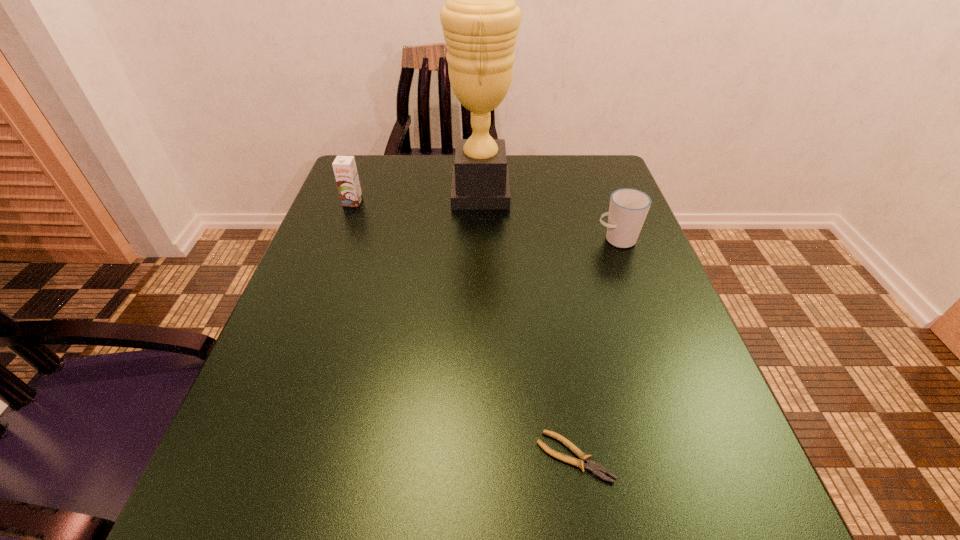
Find the location of a particular element. Image resolution: width=960 pixels, height=540 pixels. vacant region at the far edge of the desktop is located at coordinates click(x=510, y=177).

Where is `vacant space at the near edge`? Image resolution: width=960 pixels, height=540 pixels. vacant space at the near edge is located at coordinates (593, 519).

This screenshot has width=960, height=540. In the image, there is a desktop. In order to click on vacant space at the left edge in this screenshot , I will do `click(371, 300)`.

The image size is (960, 540). Find the location of `free spot at the right edge of the desktop`. free spot at the right edge of the desktop is located at coordinates (581, 218).

Identify the location of vacant space at the far left corner of the desktop. The height and width of the screenshot is (540, 960). (394, 195).

What are the coordinates of `vacant position at the far right corner of the desktop` in the screenshot? It's located at (560, 172).

The height and width of the screenshot is (540, 960). Identify the location of vacant area that lies between the chocolate milk and the third farthest object. (485, 221).

Locate an element on the screen. This screenshot has width=960, height=540. free space that is in between the chocolate milk and the shortest object is located at coordinates (464, 329).

At what (x,y) coordinates should I click in order to perform the action: click on free space that is in between the chocolate milk and the tallest object. Please return your answer as a coordinate pair (x, y). This screenshot has height=540, width=960. Looking at the image, I should click on (417, 197).

Find the location of a particular element. This screenshot has height=540, width=960. empty space between the rightmost object and the leftmost object is located at coordinates (485, 221).